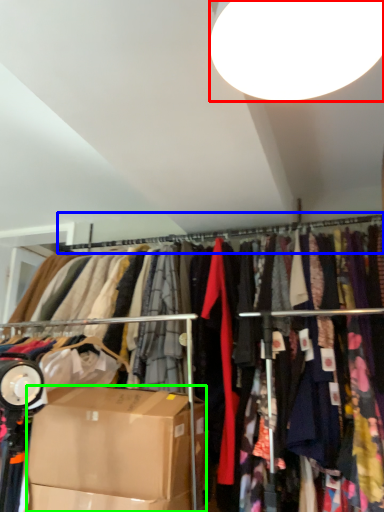
Question: Estimate the real-world distances between objects in this image. Which object is farther from lamp (highlighted by a red box), clothesline (highlighted by a blue box) or box (highlighted by a green box)?

Choices:
 (A) clothesline
 (B) box

Answer: (A)